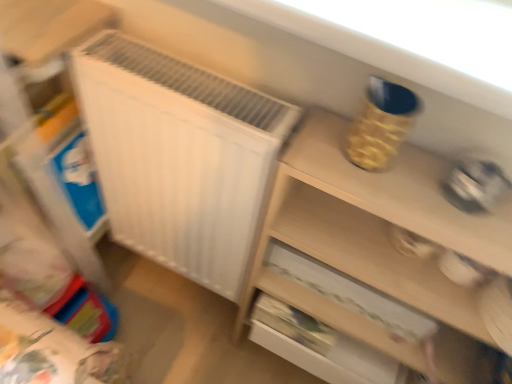
Question: Should I look upward or downward to see light wood chest of drawers at upper right?

Choices:
 (A) up
 (B) down

Answer: (B)